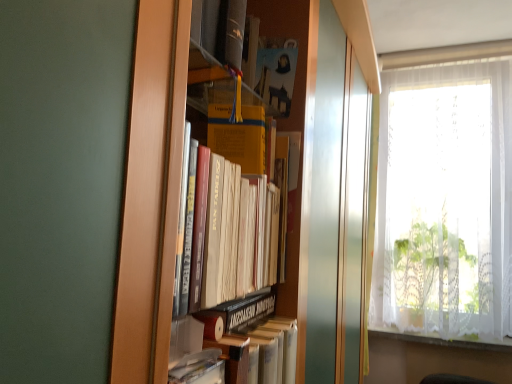
Question: Considering the positions of white lace curtain at right and white lace curtain at lower right in the image, is white lace curtain at right bigger or smaller than white lace curtain at lower right?

Choices:
 (A) big
 (B) small

Answer: (A)

Question: From a real-world perspective, relative to white lace curtain at lower right, is white lace curtain at right vertically above or below?

Choices:
 (A) above
 (B) below

Answer: (A)

Question: Which is farther from the white lace curtain at right?

Choices:
 (A) white lace curtain at lower right
 (B) hardcover book at center

Answer: (B)

Question: Which is farther from the hardcover book at center?

Choices:
 (A) white lace curtain at lower right
 (B) white lace curtain at right

Answer: (A)